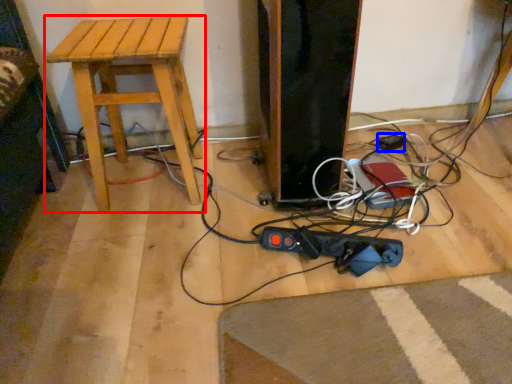
Question: Which of the following is the farthest to the observer, stool (highlighted by a red box) or plug (highlighted by a blue box)?

Choices:
 (A) stool
 (B) plug

Answer: (B)